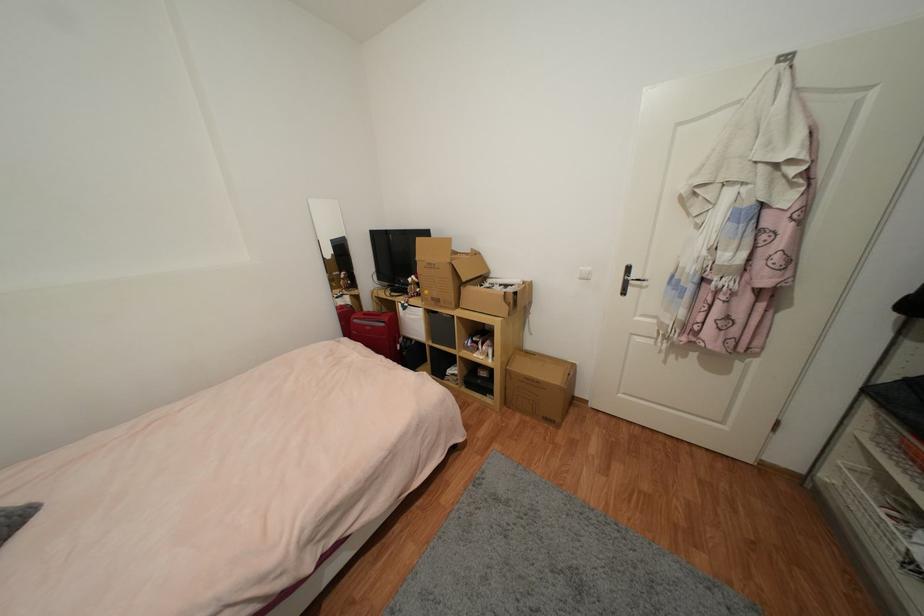
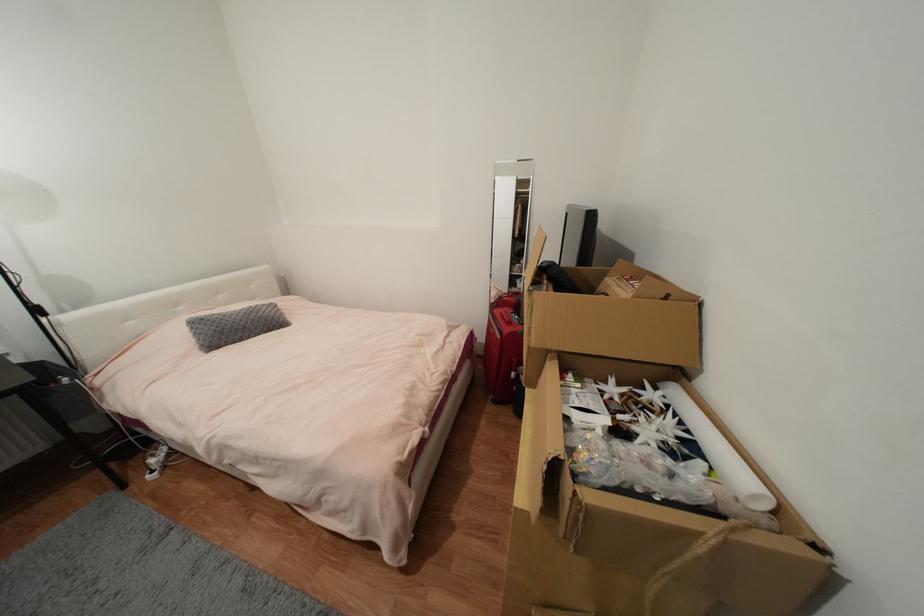
In the second image, find the point that corresponds to [403,347] in the first image.

(517, 375)